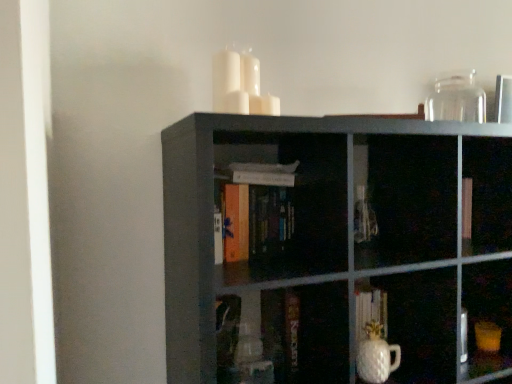
This screenshot has height=384, width=512. What do you see at coordinates (456, 98) in the screenshot?
I see `transparent glass jar at upper right, the 2th glass vase when ordered from front to back` at bounding box center [456, 98].

What do you see at coordinates (376, 359) in the screenshot? I see `white glossy vase at lower center, the second glass vase from the back` at bounding box center [376, 359].

Describe the element at coordinates (336, 248) in the screenshot. I see `matte black bookshelf at center` at that location.

This screenshot has width=512, height=384. I want to click on orange matte book at center, so click(256, 220).

The image size is (512, 384). I want to click on transparent glass jar at upper right, the 2th glass vase when ordered from front to back, so click(x=456, y=98).

Considering the sizes of objects orange matte book at center and matte black bookshelf at center in the image provided, who is bigger, orange matte book at center or matte black bookshelf at center?

Bigger between the two is matte black bookshelf at center.

Is orange matte book at center taller or shorter than matte black bookshelf at center?

Clearly, orange matte book at center is shorter compared to matte black bookshelf at center.

Is orange matte book at center to the left or to the right of matte black bookshelf at center in the image?

Result: Based on their positions, orange matte book at center is located to the left of matte black bookshelf at center.

From the image's perspective, is matte black bookshelf at center over orange matte book at center?

No, from the image's perspective, matte black bookshelf at center is not over orange matte book at center.

Is matte black bookshelf at center facing towards orange matte book at center?

Yes.

How different are the orientations of matte black bookshelf at center and orange matte book at center in degrees?

The facing directions of matte black bookshelf at center and orange matte book at center are 2.88 degrees apart.

Find the location of `shelf in front of the orange matte book at center`. shelf in front of the orange matte book at center is located at coordinates (336, 248).

Which object is positioned more to the left, transparent glass jar at upper right, which appears as the first glass vase when viewed from the top, or matte black bookshelf at center?

From the viewer's perspective, matte black bookshelf at center appears more on the left side.

From the picture: Who is taller, transparent glass jar at upper right, marked as the 1th glass vase in a back-to-front arrangement, or matte black bookshelf at center?

matte black bookshelf at center is taller.

Who is smaller, transparent glass jar at upper right, the second glass vase positioned from the left, or matte black bookshelf at center?

With smaller size is transparent glass jar at upper right, the second glass vase positioned from the left.

Is transparent glass jar at upper right, marked as the 1th glass vase in a back-to-front arrangement, looking in the opposite direction of matte black bookshelf at center?

No, transparent glass jar at upper right, marked as the 1th glass vase in a back-to-front arrangement,'s orientation is not away from matte black bookshelf at center.

In the scene shown: Which of these two, white glossy vase at lower center, the second glass vase from the right, or transparent glass jar at upper right, the 2th glass vase when ordered from front to back, stands taller?

transparent glass jar at upper right, the 2th glass vase when ordered from front to back, is taller.

From the picture: Is white glossy vase at lower center, the second glass vase from the back, with transparent glass jar at upper right, the 2th glass vase when ordered from front to back?

They are not placed beside each other.

From the image's perspective, is white glossy vase at lower center, the first glass vase from the left, above transparent glass jar at upper right, the second glass vase positioned from the bottom?

No, from the image's perspective, white glossy vase at lower center, the first glass vase from the left, is not above transparent glass jar at upper right, the second glass vase positioned from the bottom.

The image size is (512, 384). What are the coordinates of `glass vase behind the white glossy vase at lower center, which is the first glass vase in front-to-back order` in the screenshot? It's located at (456, 98).

Is orange matte book at center located outside white glossy vase at lower center, the second glass vase from the top?

That's correct, orange matte book at center is outside of white glossy vase at lower center, the second glass vase from the top.

Considering the sizes of objects orange matte book at center and white glossy vase at lower center, the second glass vase from the top, in the image provided, who is shorter, orange matte book at center or white glossy vase at lower center, the second glass vase from the top,?

With less height is white glossy vase at lower center, the second glass vase from the top.

Considering the relative sizes of orange matte book at center and white glossy vase at lower center, the second glass vase from the top, in the image provided, is orange matte book at center wider than white glossy vase at lower center, the second glass vase from the top,?

Correct, the width of orange matte book at center exceeds that of white glossy vase at lower center, the second glass vase from the top.

There is a matte black bookshelf at center. Where is `glass vase above it (from a real-world perspective)`? glass vase above it (from a real-world perspective) is located at coordinates (456, 98).

Can we say matte black bookshelf at center lies outside transparent glass jar at upper right, which appears as the first glass vase when viewed from the top?

Yes.

From a real-world perspective, is matte black bookshelf at center beneath transparent glass jar at upper right, marked as the 1th glass vase in a back-to-front arrangement?

Yes, from a real-world perspective, matte black bookshelf at center is under transparent glass jar at upper right, marked as the 1th glass vase in a back-to-front arrangement.

Considering the sizes of matte black bookshelf at center and transparent glass jar at upper right, marked as the 1th glass vase in a back-to-front arrangement, in the image, is matte black bookshelf at center bigger or smaller than transparent glass jar at upper right, marked as the 1th glass vase in a back-to-front arrangement,?

Considering their sizes, matte black bookshelf at center takes up more space than transparent glass jar at upper right, marked as the 1th glass vase in a back-to-front arrangement.

Is orange matte book at center not inside transparent glass jar at upper right, the first glass vase in the right-to-left sequence?

Yes.

Locate an element on the screen. book below the transparent glass jar at upper right, the 2th glass vase when ordered from front to back (from the image's perspective) is located at coordinates (256, 220).

Would you say orange matte book at center is a long distance from transparent glass jar at upper right, the first glass vase in the right-to-left sequence?

No, orange matte book at center is not far from transparent glass jar at upper right, the first glass vase in the right-to-left sequence.

In the image, there is a orange matte book at center. Identify the location of shelf below it (from the image's perspective). The image size is (512, 384). (336, 248).

The width and height of the screenshot is (512, 384). I want to click on book on the left of matte black bookshelf at center, so click(x=256, y=220).

Based on their spatial positions, is white glossy vase at lower center, the second glass vase from the top, or orange matte book at center closer to matte black bookshelf at center?

Among the two, orange matte book at center is located nearer to matte black bookshelf at center.

Looking at the image, which one is located further to transparent glass jar at upper right, the second glass vase positioned from the left, matte black bookshelf at center or orange matte book at center?

orange matte book at center is positioned further to the anchor transparent glass jar at upper right, the second glass vase positioned from the left.

From the picture: Based on their spatial positions, is transparent glass jar at upper right, the first glass vase in the right-to-left sequence, or matte black bookshelf at center closer to white glossy vase at lower center, the second glass vase from the top?

matte black bookshelf at center.

From the image, which object appears to be nearer to matte black bookshelf at center, orange matte book at center or transparent glass jar at upper right, which appears as the first glass vase when viewed from the top?

Among the two, orange matte book at center is located nearer to matte black bookshelf at center.

Considering their positions, is transparent glass jar at upper right, the second glass vase positioned from the left, positioned closer to matte black bookshelf at center than orange matte book at center?

orange matte book at center is positioned closer to the anchor matte black bookshelf at center.

When comparing their distances from transparent glass jar at upper right, the second glass vase positioned from the bottom, does orange matte book at center or white glossy vase at lower center, the first glass vase from the left, seem further?

Based on the image, white glossy vase at lower center, the first glass vase from the left, appears to be further to transparent glass jar at upper right, the second glass vase positioned from the bottom.

Which object lies further to the anchor point transparent glass jar at upper right, the 2th glass vase when ordered from front to back, white glossy vase at lower center, the second glass vase from the right, or matte black bookshelf at center?

Based on the image, white glossy vase at lower center, the second glass vase from the right, appears to be further to transparent glass jar at upper right, the 2th glass vase when ordered from front to back.

Looking at the image, which one is located further to white glossy vase at lower center, the first glass vase in the bottom-to-top sequence, matte black bookshelf at center or orange matte book at center?

orange matte book at center.

You are a GUI agent. You are given a task and a screenshot of the screen. Output one action in this format:
    pyautogui.click(x=<x>, y=<y>)
    Task: Click on the shelf between orange matte book at center and transparent glass jar at upper right, the second glass vase positioned from the bottom, from left to right
    The width and height of the screenshot is (512, 384).
    Given the screenshot: What is the action you would take?
    pyautogui.click(x=336, y=248)

Locate an element on the screen. Image resolution: width=512 pixels, height=384 pixels. book between transparent glass jar at upper right, the 2th glass vase when ordered from front to back, and white glossy vase at lower center, the first glass vase from the left, in the up-down direction is located at coordinates (256, 220).

What are the coordinates of `shelf between transparent glass jar at upper right, the second glass vase positioned from the bottom, and white glossy vase at lower center, the first glass vase from the left, in the up-down direction` in the screenshot? It's located at (336, 248).

The image size is (512, 384). I want to click on shelf between orange matte book at center and white glossy vase at lower center, the first glass vase from the left, so click(336, 248).